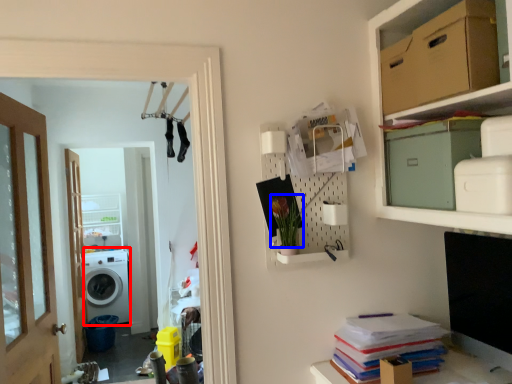
Question: Which object is closer to the camera taking this photo, washing machine (highlighted by a red box) or plant (highlighted by a blue box)?

Choices:
 (A) washing machine
 (B) plant

Answer: (B)